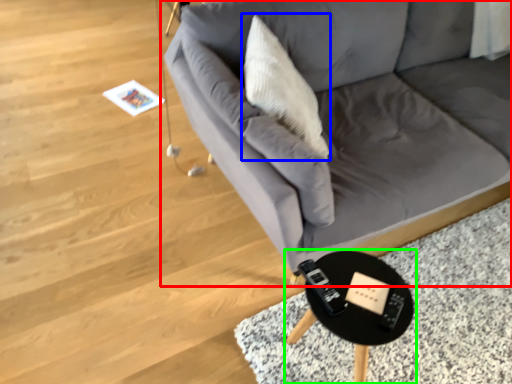
Question: Considering the real-world distances, which object is farthest from studio couch (highlighted by a red box)? throw pillow (highlighted by a blue box) or table (highlighted by a green box)?

Choices:
 (A) throw pillow
 (B) table

Answer: (B)